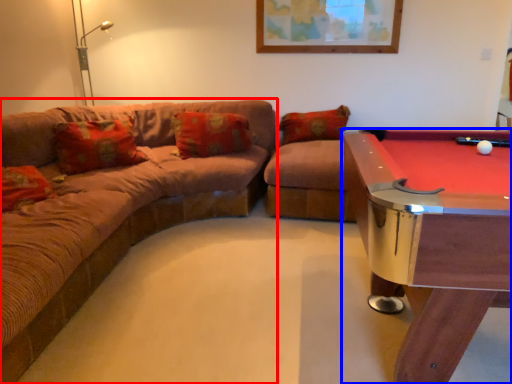
Question: Which point is further to the camera, studio couch (highlighted by a red box) or billiard table (highlighted by a blue box)?

Choices:
 (A) studio couch
 (B) billiard table

Answer: (B)